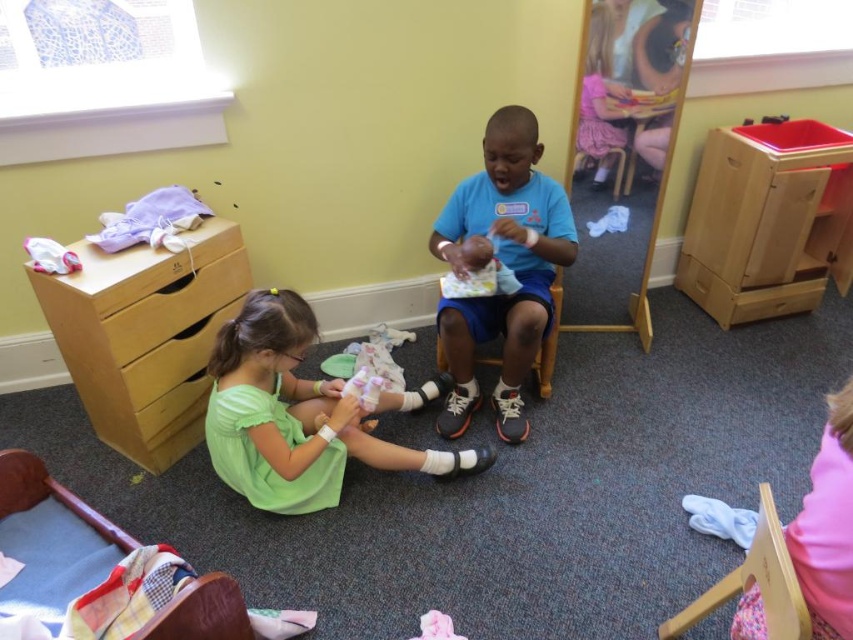
Question: Which point is closer to the camera?

Choices:
 (A) wooden dresser at left
 (B) blue matte shirt at center

Answer: (A)

Question: Can you confirm if wooden drawer at right is wider than blue matte shirt at center?

Choices:
 (A) yes
 (B) no

Answer: (A)

Question: Does wooden dresser at left appear under wooden drawer at right?

Choices:
 (A) no
 (B) yes

Answer: (B)

Question: Which point is farther to the camera?

Choices:
 (A) wooden drawer at right
 (B) wooden dresser at left
 (C) blue matte shirt at center
 (D) green fabric doll at lower center

Answer: (A)

Question: Which object appears closest to the camera in this image?

Choices:
 (A) green fabric doll at lower center
 (B) blue matte shirt at center
 (C) wooden dresser at left
 (D) wooden drawer at right

Answer: (C)

Question: Does wooden drawer at right appear on the right side of green fabric doll at lower center?

Choices:
 (A) yes
 (B) no

Answer: (A)